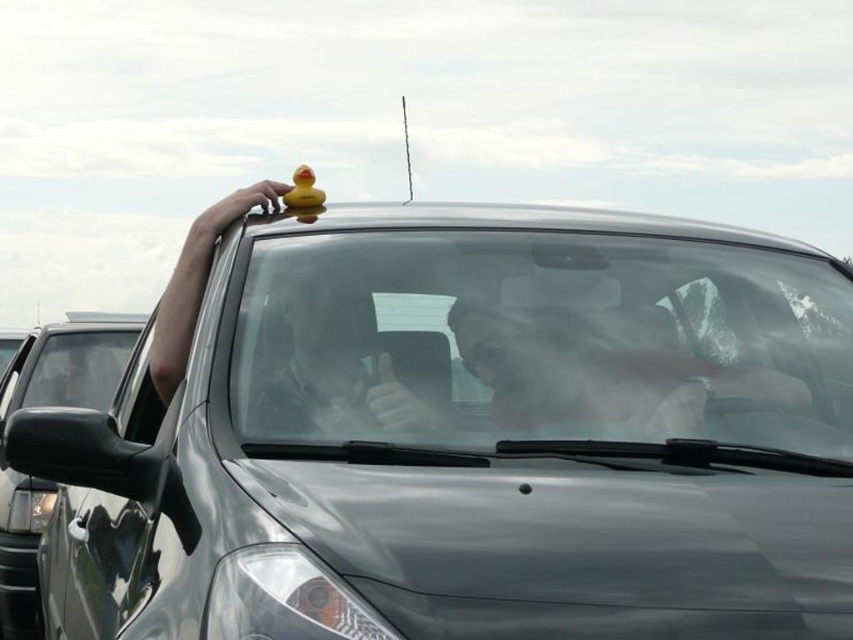
Question: Is clear glass windshield at center closer to camera compared to glossy metallic car at left?

Choices:
 (A) yes
 (B) no

Answer: (A)

Question: Which point is farther to the camera?

Choices:
 (A) glossy rubber duck at upper center
 (B) clear glass windshield at center
 (C) glossy metallic car at left
 (D) rubber duck at center

Answer: (C)

Question: Where is glossy rubber duck at upper center located in relation to glossy metallic car at left in the image?

Choices:
 (A) above
 (B) below

Answer: (A)

Question: Which point is closer to the camera taking this photo?

Choices:
 (A) (32, 582)
 (B) (299, 200)

Answer: (B)

Question: Which object is farther from the camera taking this photo?

Choices:
 (A) clear glass windshield at center
 (B) rubber duck at center
 (C) glossy metallic car at left

Answer: (C)

Question: Is glossy rubber duck at upper center below glossy metallic car at left?

Choices:
 (A) no
 (B) yes

Answer: (A)